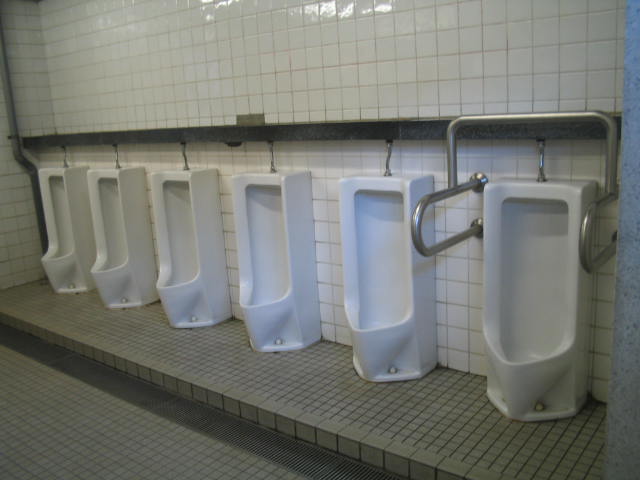
Where is `dirty floor in urinal`? dirty floor in urinal is located at coordinates (483, 378), (470, 369), (441, 372), (352, 347), (332, 347), (326, 339), (239, 320), (157, 304), (592, 394).